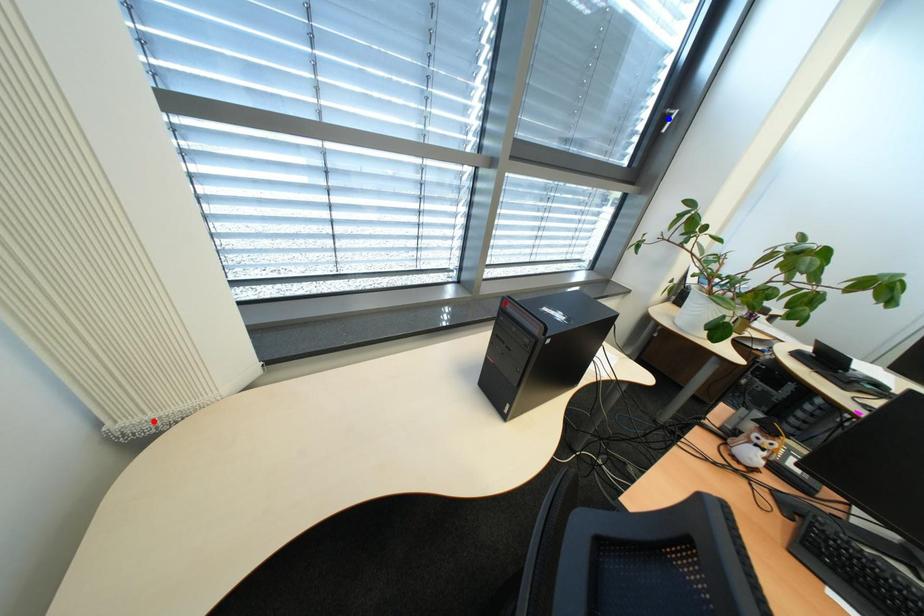
Question: Which of the two points in the image is closer to the camera?

Choices:
 (A) Blue point is closer.
 (B) Red point is closer.

Answer: (B)